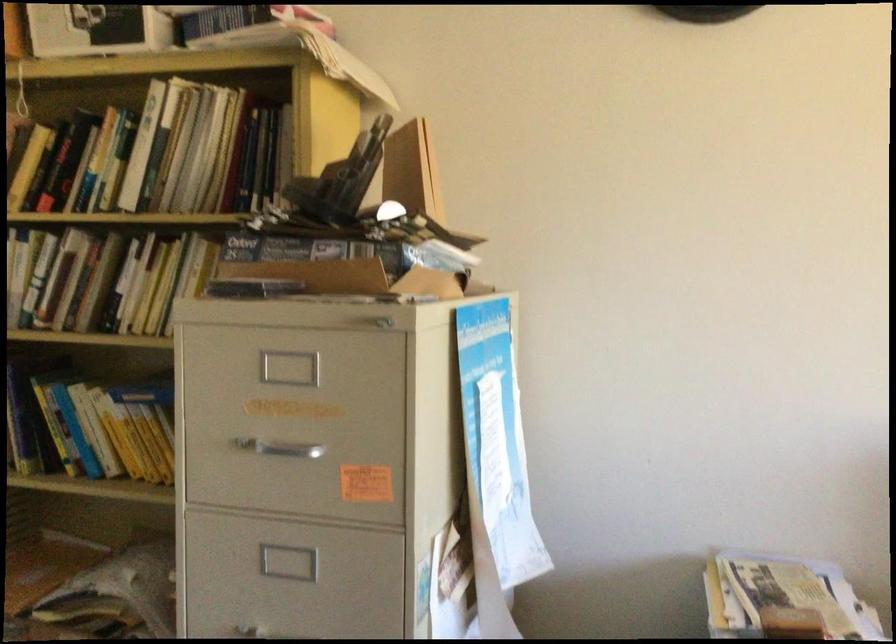
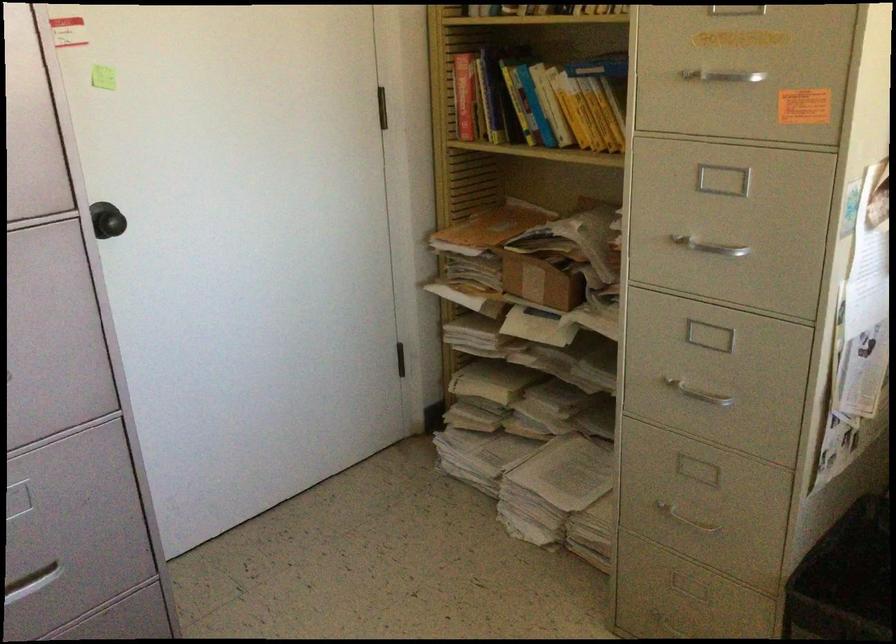
Find the pixel in the second image that matches pixel 144 438 in the first image.

(590, 114)